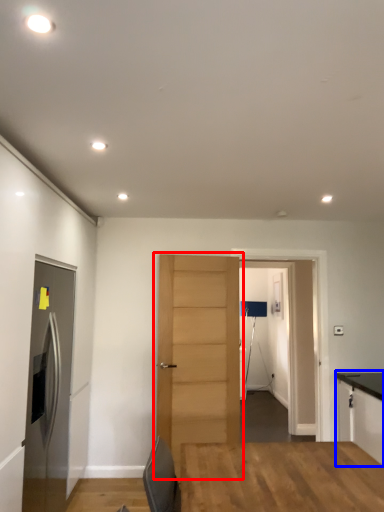
Question: Which object appears closest to the camera in this image, door (highlighted by a red box) or cabinetry (highlighted by a blue box)?

Choices:
 (A) door
 (B) cabinetry

Answer: (B)